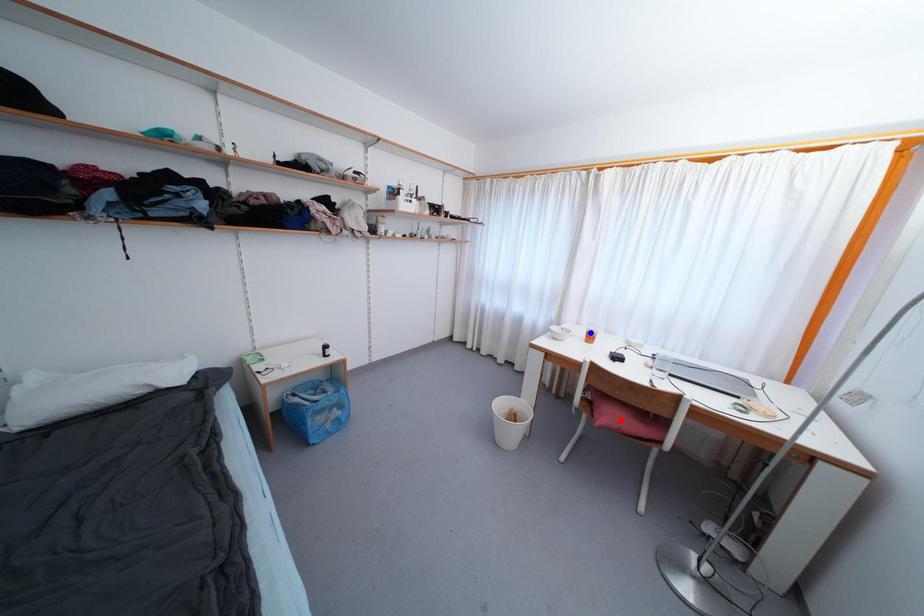
Question: Two points are marked on the image. Which point is closer to the camera?

Choices:
 (A) Blue point is closer.
 (B) Red point is closer.

Answer: (B)